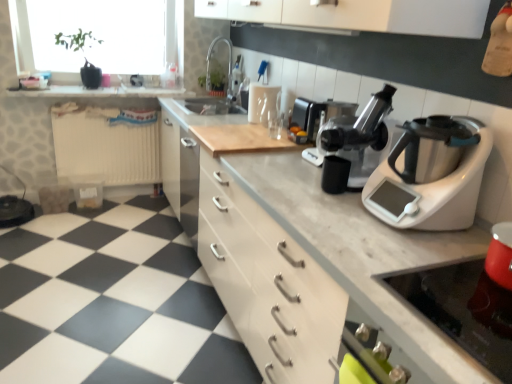
What are the coordinates of `vacant area that is in front of black plastic juicer at center` in the screenshot? It's located at (336, 206).